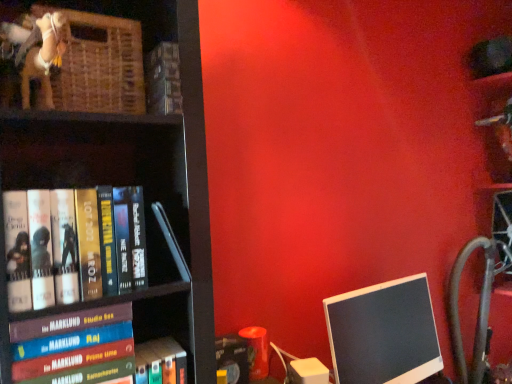
Question: Which direction should I rotate to look at hardcover book at upper center, the fifth book in the bottom-to-top sequence?

Choices:
 (A) right
 (B) left

Answer: (B)

Question: Does hardcover book at upper center, the fifth book in the bottom-to-top sequence, come behind hardcover book at left, which is the 3th book from top to bottom?

Choices:
 (A) no
 (B) yes

Answer: (B)

Question: Is hardcover book at upper center, the fifth book in the bottom-to-top sequence, not within hardcover book at left, marked as the third book in a bottom-to-top arrangement?

Choices:
 (A) no
 (B) yes

Answer: (B)

Question: Does hardcover book at upper center, the fifth book in the bottom-to-top sequence, come in front of hardcover book at left, marked as the third book in a bottom-to-top arrangement?

Choices:
 (A) no
 (B) yes

Answer: (A)

Question: Is hardcover book at upper center, arranged as the first book when viewed from the top, directly adjacent to hardcover book at left, marked as the third book in a bottom-to-top arrangement?

Choices:
 (A) yes
 (B) no

Answer: (B)

Question: Can you confirm if hardcover book at upper center, arranged as the first book when viewed from the top, is taller than hardcover book at left, which is the 3th book from top to bottom?

Choices:
 (A) yes
 (B) no

Answer: (B)

Question: Is hardcover book at left, which is the 3th book from top to bottom, surrounded by hardcover book at upper center, the fifth book in the bottom-to-top sequence?

Choices:
 (A) no
 (B) yes

Answer: (A)

Question: Can you confirm if hardcover book at lower left, which is counted as the fourth book, starting from the top, is smaller than black glossy monitor at lower right?

Choices:
 (A) no
 (B) yes

Answer: (B)

Question: From a real-world perspective, is hardcover book at lower left, the 2th book from the bottom, positioned over black glossy monitor at lower right based on gravity?

Choices:
 (A) no
 (B) yes

Answer: (B)

Question: From a real-world perspective, is hardcover book at lower left, which is counted as the fourth book, starting from the top, beneath black glossy monitor at lower right?

Choices:
 (A) yes
 (B) no

Answer: (B)

Question: Is hardcover book at lower left, the 2th book from the bottom, surrounding black glossy monitor at lower right?

Choices:
 (A) no
 (B) yes

Answer: (A)

Question: Considering the relative sizes of hardcover book at lower left, the 2th book from the bottom, and black glossy monitor at lower right in the image provided, is hardcover book at lower left, the 2th book from the bottom, bigger than black glossy monitor at lower right?

Choices:
 (A) yes
 (B) no

Answer: (B)

Question: Could you tell me if hardcover book at lower left, the 2th book from the bottom, is facing black glossy monitor at lower right?

Choices:
 (A) no
 (B) yes

Answer: (A)

Question: Is black glossy monitor at lower right turned away from hardcover book at left, the 4th book when ordered from bottom to top?

Choices:
 (A) no
 (B) yes

Answer: (A)